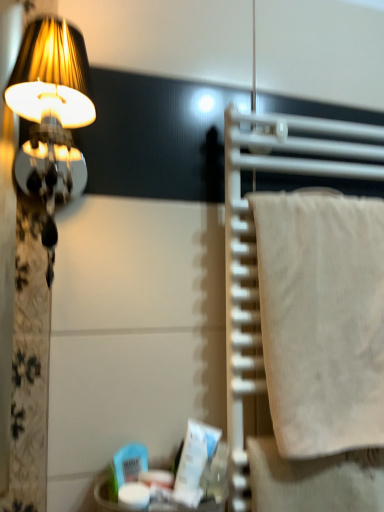
Question: From a real-world perspective, is white cotton towel at right above or below matte gold lampshade at left?

Choices:
 (A) above
 (B) below

Answer: (B)

Question: From the image's perspective, relative to matte gold lampshade at left, is white cotton towel at right above or below?

Choices:
 (A) below
 (B) above

Answer: (A)

Question: In terms of width, does white cotton towel at right look wider or thinner when compared to matte gold lampshade at left?

Choices:
 (A) wide
 (B) thin

Answer: (B)

Question: Looking at their shapes, would you say matte gold lampshade at left is wider or thinner than white cotton towel at right?

Choices:
 (A) thin
 (B) wide

Answer: (B)

Question: Choose the correct answer: Is matte gold lampshade at left inside white cotton towel at right or outside it?

Choices:
 (A) outside
 (B) inside

Answer: (A)

Question: From a real-world perspective, is matte gold lampshade at left positioned above or below white cotton towel at right?

Choices:
 (A) above
 (B) below

Answer: (A)

Question: Is matte gold lampshade at left to the left or to the right of white cotton towel at right in the image?

Choices:
 (A) left
 (B) right

Answer: (A)